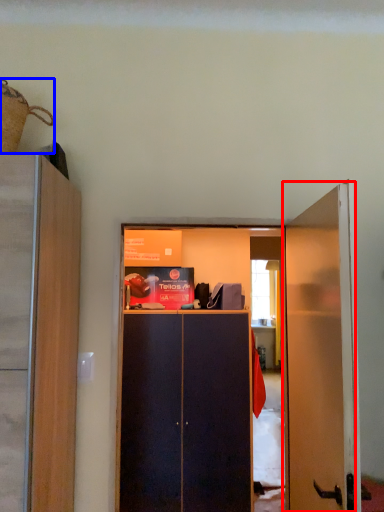
Question: Which object appears farthest to the camera in this image, door (highlighted by a red box) or houseplant (highlighted by a blue box)?

Choices:
 (A) door
 (B) houseplant

Answer: (B)